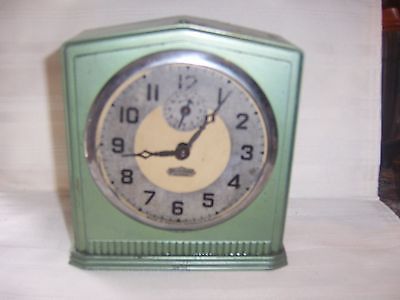
The height and width of the screenshot is (300, 400). I want to click on green clock, so click(187, 32).